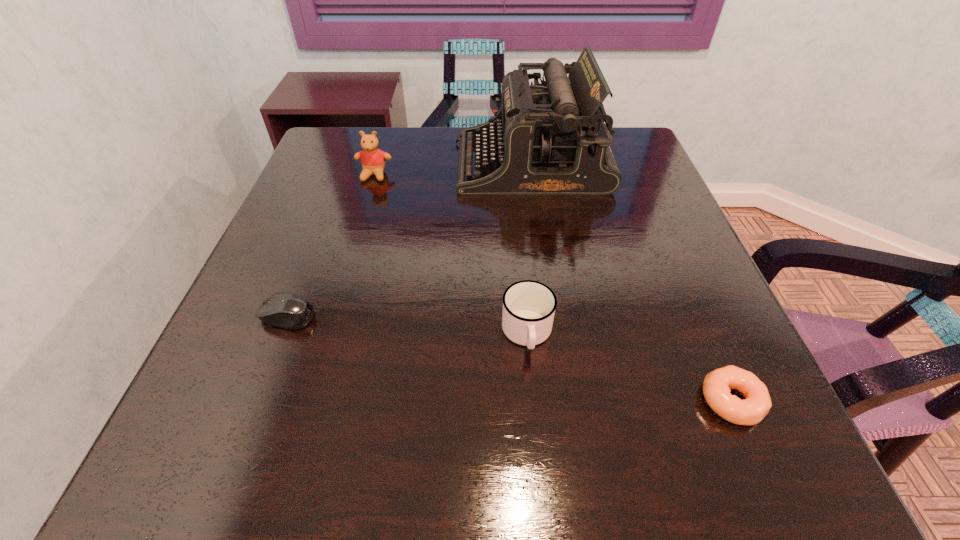
Locate an element on the screen. free space between the typewriter and the nearest object is located at coordinates (631, 282).

I want to click on free space between the mouse and the second tallest object, so 331,245.

In order to click on vacant point located between the doughnut and the typewriter in this screenshot , I will do `click(631, 282)`.

Find the location of `blank region between the third shortest object and the teddy bear`. blank region between the third shortest object and the teddy bear is located at coordinates (450, 254).

Locate an element on the screen. blank region between the second tallest object and the third tallest object is located at coordinates (450, 254).

This screenshot has height=540, width=960. Find the location of `vacant space that is in between the mouse and the rightmost object`. vacant space that is in between the mouse and the rightmost object is located at coordinates pyautogui.click(x=509, y=358).

You are a GUI agent. You are given a task and a screenshot of the screen. Output one action in this format:
    pyautogui.click(x=<x>, y=<y>)
    Task: Click on the free space between the typewriter and the mouse
    The width and height of the screenshot is (960, 540).
    Given the screenshot: What is the action you would take?
    pyautogui.click(x=409, y=240)

The height and width of the screenshot is (540, 960). Identify the location of the third closest object relative to the nearest object. (282, 309).

Identify which object is located as the second nearest to the mouse. Please provide its 2D coordinates. Your answer should be formatted as a tuple, i.e. [(x, y)], where the tuple contains the x and y coordinates of a point satisfying the conditions above.

[(373, 159)]

Locate an element on the screen. This screenshot has height=540, width=960. blank area in the image that satisfies the following two spatial constraints: 1. on the keyboard of the typewriter; 2. on the side of the mug with the handle is located at coordinates (556, 333).